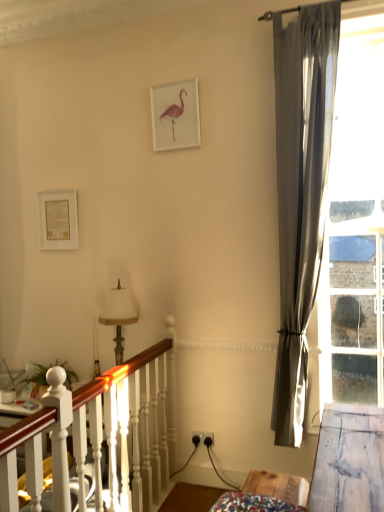
Question: Considering their positions, is white wooden bed frame at lower left located in front of or behind white fabric lampshade at center-left?

Choices:
 (A) behind
 (B) front

Answer: (B)

Question: Considering the positions of white wooden bed frame at lower left and white fabric lampshade at center-left in the image, is white wooden bed frame at lower left taller or shorter than white fabric lampshade at center-left?

Choices:
 (A) tall
 (B) short

Answer: (A)

Question: Considering the real-world distances, which object is closest to the clear glass window at right?

Choices:
 (A) wooden table at lower right
 (B) matte gold picture frame at upper left, placed as the 1th picture frame when sorted from bottom to top
 (C) white fabric lampshade at center-left
 (D) white wooden bed frame at lower left
 (E) satin gray curtain at right

Answer: (E)

Question: Which of these objects is positioned farthest from the matte gold picture frame at upper left, the 2th picture frame in the top-to-bottom sequence?

Choices:
 (A) clear glass window at right
 (B) white matte picture frame at upper center, placed as the first picture frame when sorted from front to back
 (C) satin gray curtain at right
 (D) white wooden bed frame at lower left
 (E) white fabric lampshade at center-left

Answer: (A)